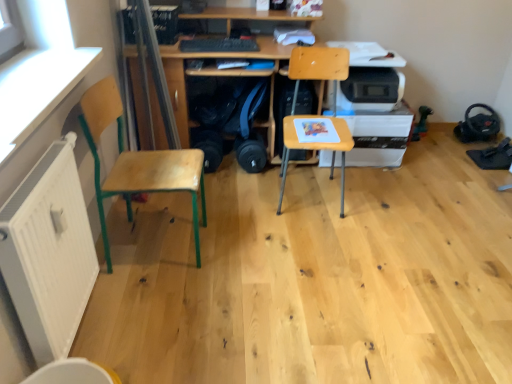
In order to click on vacant area located to the right-hand side of wooden chair at center, arranged as the first chair when viewed from the right in this screenshot , I will do `click(371, 200)`.